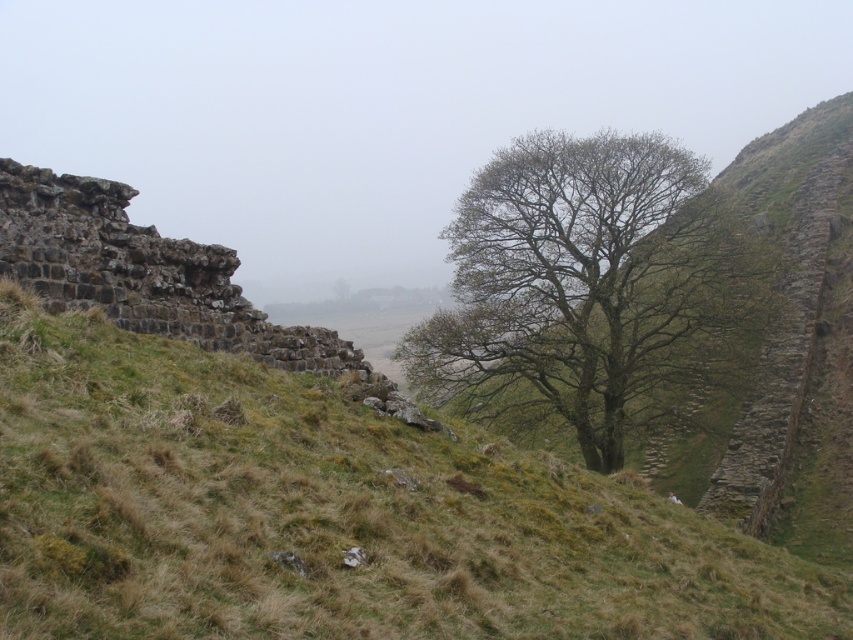
Can you confirm if green leafy tree at center is shorter than rustic stone cliff at left?

No.

Does green leafy tree at center have a greater width compared to rustic stone cliff at left?

Yes, green leafy tree at center is wider than rustic stone cliff at left.

I want to click on green leafy tree at center, so click(585, 285).

This screenshot has width=853, height=640. Identify the location of green leafy tree at center. (585, 285).

Is green grassy at center bigger than green leafy tree at center?

No.

Based on the photo, does green grassy at center have a lesser height compared to green leafy tree at center?

Indeed, green grassy at center has a lesser height compared to green leafy tree at center.

Where is `green grassy at center`? This screenshot has width=853, height=640. green grassy at center is located at coordinates (331, 513).

Between green grassy at center and rustic stone cliff at left, which one is positioned lower?

Positioned lower is green grassy at center.

Who is more distant from viewer, (62, 570) or (74, 259)?

The point (74, 259) is behind.

Where is `green grassy at center`? The height and width of the screenshot is (640, 853). green grassy at center is located at coordinates [331, 513].